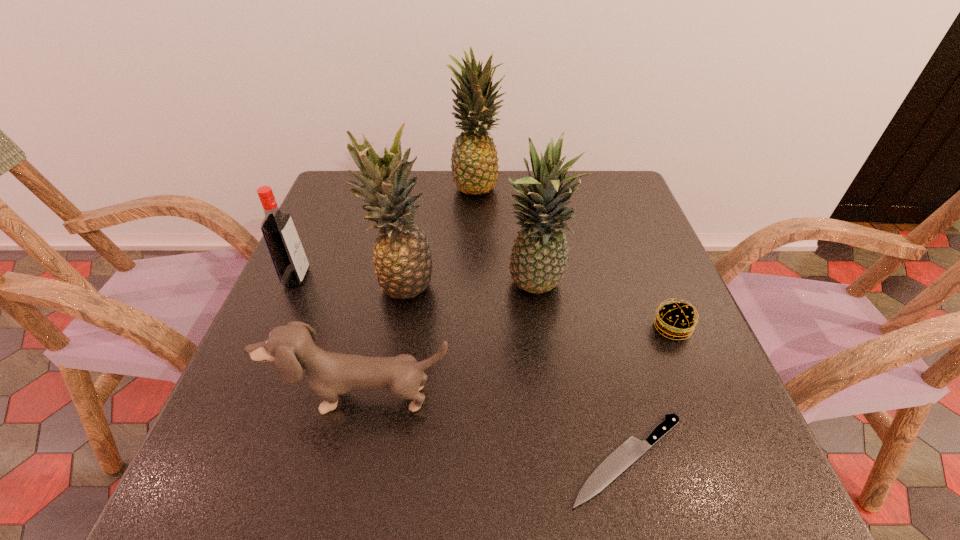
You are a GUI agent. You are given a task and a screenshot of the screen. Output one action in this format:
    pyautogui.click(x=<x>, y=<y>)
    Task: Click on the free space that is in between the rightmost object and the steak knife
    This screenshot has width=960, height=540.
    Given the screenshot: What is the action you would take?
    pyautogui.click(x=650, y=394)

Find the location of `empty space between the leftmost pineapple and the farthest pineapple`. empty space between the leftmost pineapple and the farthest pineapple is located at coordinates (441, 234).

Locate an element on the screen. The image size is (960, 540). free space that is in between the steak knife and the fourth tallest object is located at coordinates (463, 369).

Locate an element on the screen. free space between the leftmost pineapple and the farthest pineapple is located at coordinates (441, 234).

Locate an element on the screen. This screenshot has height=540, width=960. blank region between the leftmost pineapple and the farthest object is located at coordinates (441, 234).

Point out which object is positioned as the fifth nearest to the farthest pineapple. Please provide its 2D coordinates. Your answer should be formatted as a tuple, i.e. [(x, y)], where the tuple contains the x and y coordinates of a point satisfying the conditions above.

[(329, 374)]

You are a GUI agent. You are given a task and a screenshot of the screen. Output one action in this format:
    pyautogui.click(x=<x>, y=<y>)
    Task: Click on the object that ranks as the fifth closest to the fifth tallest object
    
    Given the screenshot: What is the action you would take?
    pyautogui.click(x=675, y=320)

Locate which pineapple ranks second in proximity to the farthest object. Please provide its 2D coordinates. Your answer should be formatted as a tuple, i.e. [(x, y)], where the tuple contains the x and y coordinates of a point satisfying the conditions above.

[(539, 258)]

You are a GUI agent. You are given a task and a screenshot of the screen. Output one action in this format:
    pyautogui.click(x=<x>, y=<y>)
    Task: Click on the pineapple that is the nearest to the shortest object
    The height and width of the screenshot is (540, 960).
    Given the screenshot: What is the action you would take?
    pyautogui.click(x=539, y=258)

Identify the location of vacant space that satisfies the following two spatial constraints: 1. at the face of the puppy; 2. on the right side of the shortest object. (348, 459).